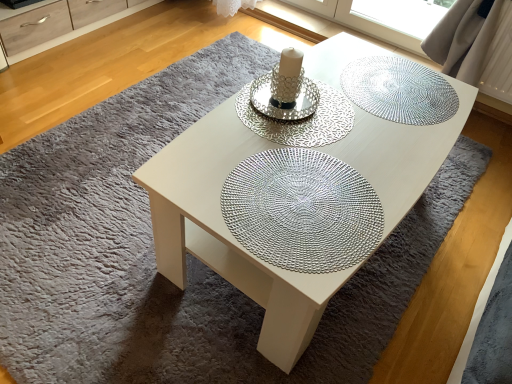
What are the coordinates of `vacant region above metallic silver doily at upper right, positioned as the third glass plate in front-to-back order (from a real-world perspective)` in the screenshot? It's located at (395, 85).